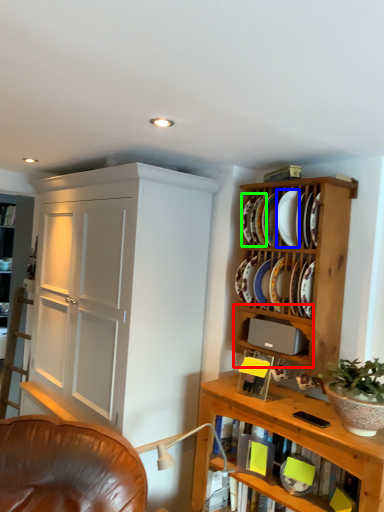
Question: Which object is positioned closest to cabinet (highlighted by a red box)? Select from plate (highlighted by a blue box) and platter (highlighted by a green box).

Choices:
 (A) plate
 (B) platter

Answer: (A)